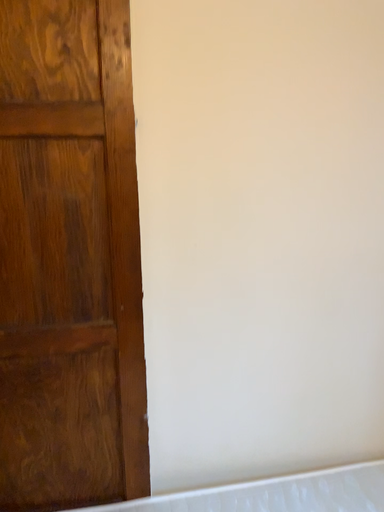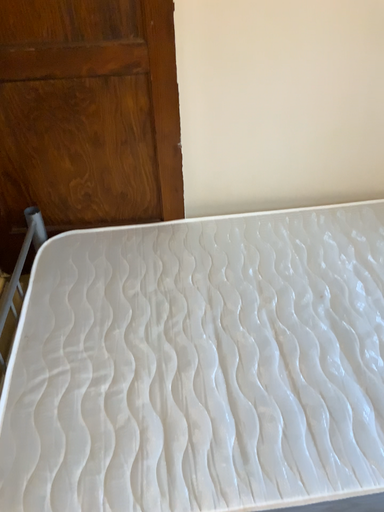
Question: How did the camera likely rotate when shooting the video?

Choices:
 (A) rotated downward
 (B) rotated upward

Answer: (A)